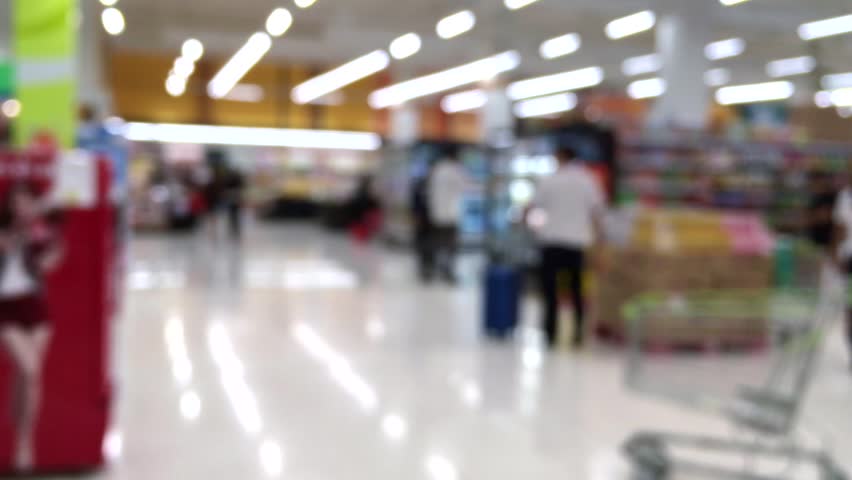
Locate an element on the screen. This screenshot has height=480, width=852. floor is located at coordinates click(x=337, y=376).